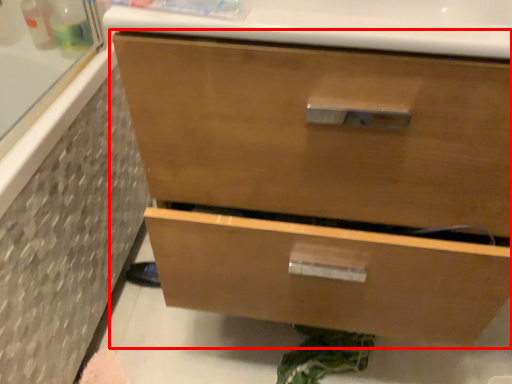
Question: Where is chest of drawers (annotated by the red box) located in relation to bath in the image?

Choices:
 (A) left
 (B) right

Answer: (B)